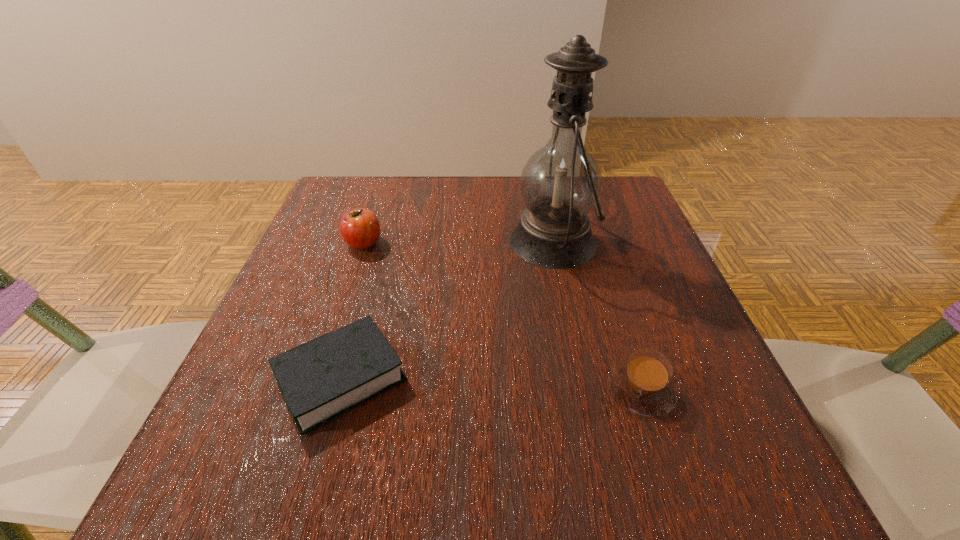
Where is `blank region between the apple and the third tallest object`? The image size is (960, 540). blank region between the apple and the third tallest object is located at coordinates (502, 316).

Locate an element on the screen. This screenshot has width=960, height=540. vacant point located between the shortest object and the apple is located at coordinates (352, 310).

Locate an element on the screen. Image resolution: width=960 pixels, height=540 pixels. free space between the apple and the oil lamp is located at coordinates (458, 242).

Where is `free point between the shortest object and the tallest object`? The image size is (960, 540). free point between the shortest object and the tallest object is located at coordinates (447, 310).

The width and height of the screenshot is (960, 540). What are the coordinates of `vacant area between the Bible and the third shortest object` in the screenshot? It's located at (352, 310).

Locate an element on the screen. The image size is (960, 540). vacant area that lies between the tallest object and the second tallest object is located at coordinates (458, 242).

Where is `vacant space that is in between the shortest object and the oil lamp`? The height and width of the screenshot is (540, 960). vacant space that is in between the shortest object and the oil lamp is located at coordinates (447, 310).

Where is `free space that is in between the apple and the Bible`? The width and height of the screenshot is (960, 540). free space that is in between the apple and the Bible is located at coordinates (352, 310).

Image resolution: width=960 pixels, height=540 pixels. What are the coordinates of `vacant space that is in between the oil lamp and the Bible` in the screenshot? It's located at (447, 310).

Identify which object is located as the nearest to the Bible. Please provide its 2D coordinates. Your answer should be formatted as a tuple, i.e. [(x, y)], where the tuple contains the x and y coordinates of a point satisfying the conditions above.

[(360, 229)]